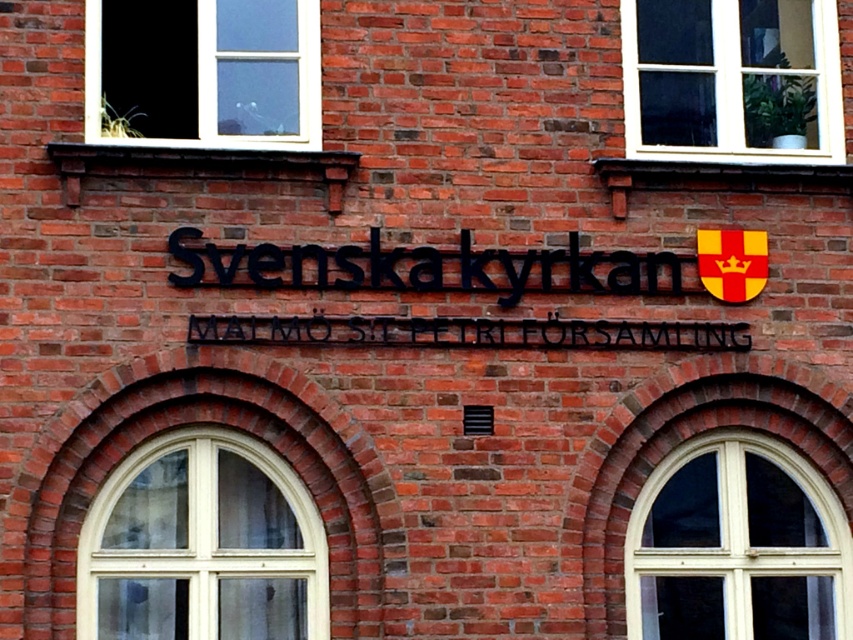
Question: Which object is positioned closest to the white plastic window at upper right?

Choices:
 (A) white wood window at lower left
 (B) black metal sign at center

Answer: (B)

Question: Does clear glass window at upper left appear on the right side of black metal sign at center?

Choices:
 (A) yes
 (B) no

Answer: (B)

Question: Which of the following is the farthest from the observer?

Choices:
 (A) white plastic window at upper right
 (B) clear glass window at upper left

Answer: (A)

Question: Which point is closer to the camera?

Choices:
 (A) (469, 244)
 (B) (312, 51)
 (C) (144, 452)
 (D) (811, 486)

Answer: (C)

Question: Is white wooden window at lower right to the left of clear glass window at upper left from the viewer's perspective?

Choices:
 (A) no
 (B) yes

Answer: (A)

Question: Does white wood window at lower left appear on the left side of clear glass window at upper left?

Choices:
 (A) yes
 (B) no

Answer: (B)